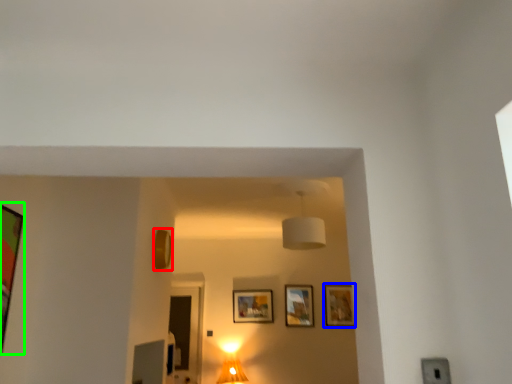
Question: Based on their relative distances, which object is farther from picture frame (highlighted by a red box)? Choose from picture frame (highlighted by a blue box) and picture frame (highlighted by a green box).

Choices:
 (A) picture frame
 (B) picture frame

Answer: (A)